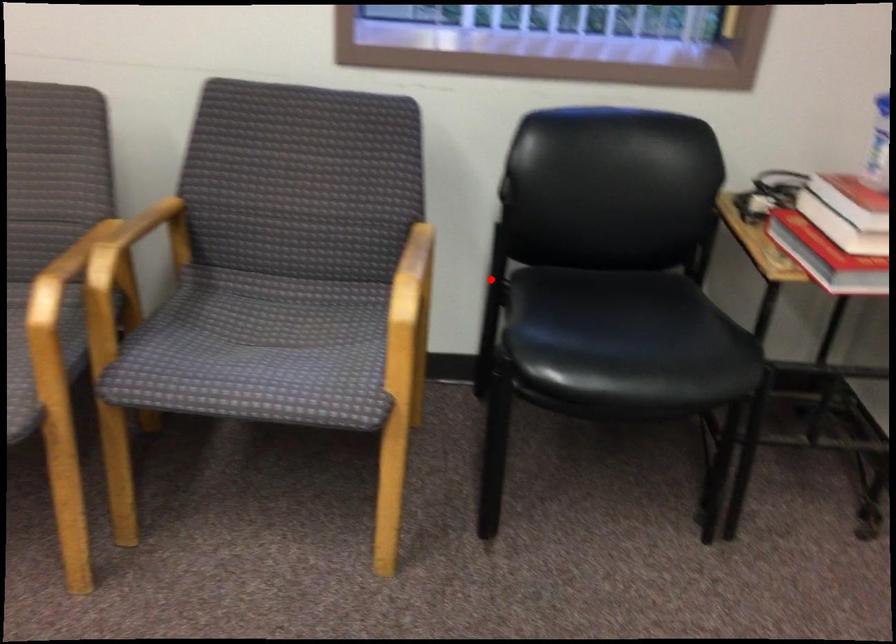
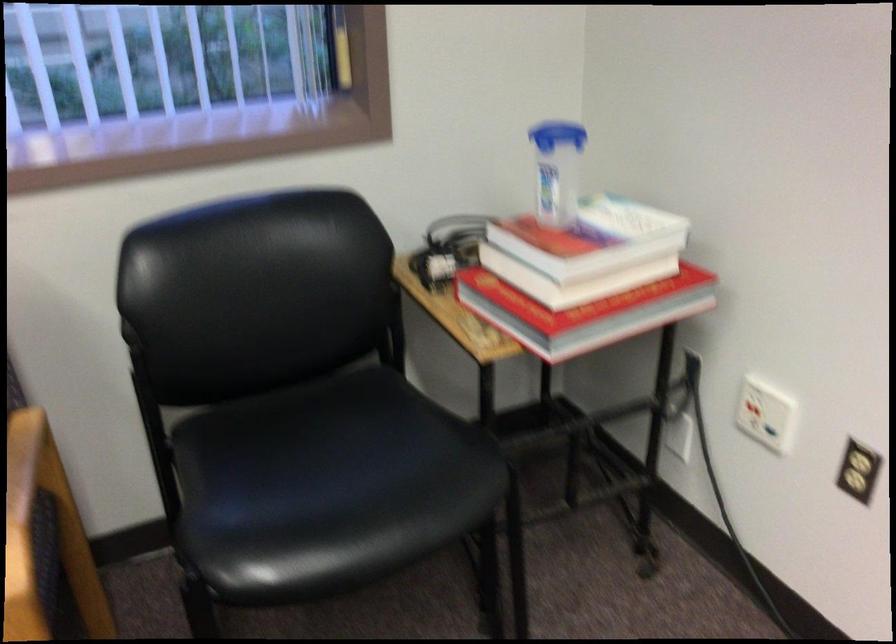
The point at the highlighted location is marked in the first image. Where is the corresponding point in the second image?

(151, 421)